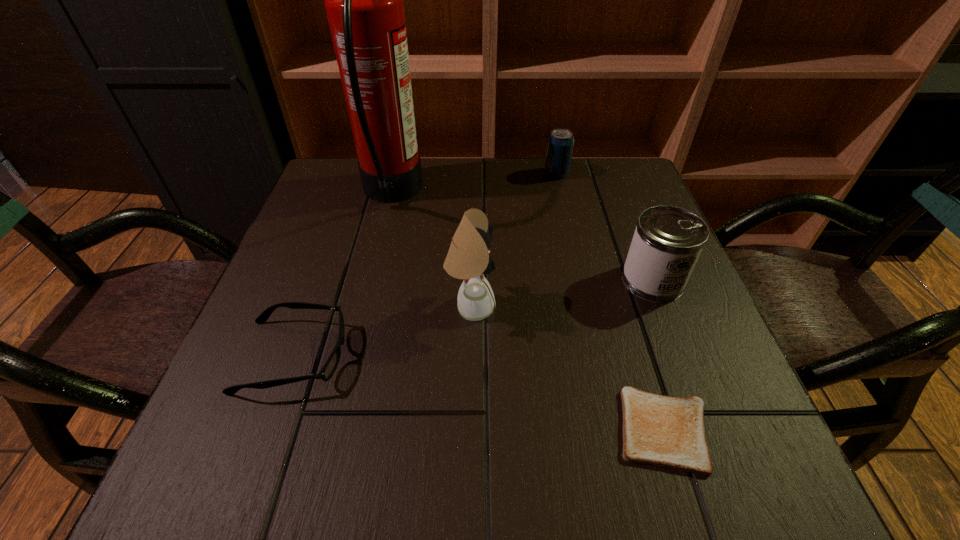
This screenshot has width=960, height=540. Identify the location of empty location between the pop soda and the shortest object. (611, 301).

Locate an element on the screen. vacant area that lies between the pop soda and the fourth shortest object is located at coordinates 605,227.

At what (x,y) coordinates should I click in order to perform the action: click on vacant space that is in between the fire extinguisher and the fifth shortest object. Please return your answer as a coordinate pair (x, y). This screenshot has height=540, width=960. Looking at the image, I should click on (431, 249).

The width and height of the screenshot is (960, 540). In order to click on blank region between the shortest object and the tallest object in this screenshot , I will do `click(528, 312)`.

Where is `vacant region between the tallest object and the third object from left to right`? This screenshot has height=540, width=960. vacant region between the tallest object and the third object from left to right is located at coordinates (431, 249).

Locate an element on the screen. free space between the shortest object and the spectacles is located at coordinates (479, 393).

Where is `the third closest object to the spectacles`? This screenshot has width=960, height=540. the third closest object to the spectacles is located at coordinates (662, 431).

The width and height of the screenshot is (960, 540). I want to click on the third closest object to the second shortest object, so click(x=662, y=431).

I want to click on vacant position in the image that satisfies the following two spatial constraints: 1. on the front side of the third tallest object; 2. on the front-facing side of the second shortest object, so click(682, 356).

Where is `vacant space that satisfies the following two spatial constraints: 1. on the front-facing side of the fire extinguisher; 2. on the left side of the shortest object`? vacant space that satisfies the following two spatial constraints: 1. on the front-facing side of the fire extinguisher; 2. on the left side of the shortest object is located at coordinates (333, 430).